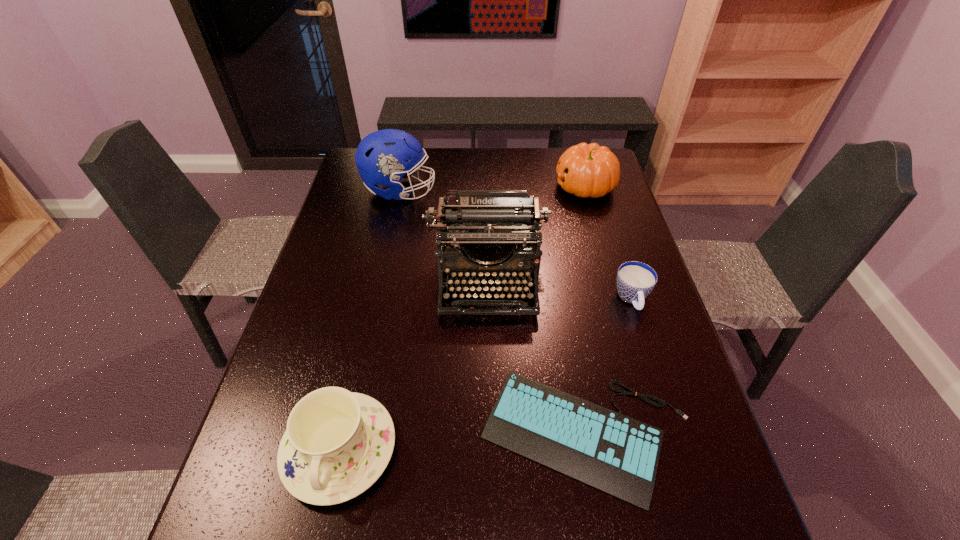
Where is `object that is positioned at the far left corner`? This screenshot has width=960, height=540. object that is positioned at the far left corner is located at coordinates (382, 157).

Find the location of a particular element. This screenshot has height=540, width=960. object located in the far right corner section of the desktop is located at coordinates (586, 170).

Locate an element on the screen. The image size is (960, 540). free space at the far edge of the desktop is located at coordinates (514, 157).

Where is `vacant space at the left edge of the desktop`? This screenshot has height=540, width=960. vacant space at the left edge of the desktop is located at coordinates (325, 357).

Locate an element on the screen. Image resolution: width=960 pixels, height=540 pixels. vacant space at the right edge of the desktop is located at coordinates (619, 207).

This screenshot has width=960, height=540. I want to click on free spot between the computer keyboard and the pumpkin, so click(x=587, y=312).

Where is `free space between the shortest object and the pumpkin`? free space between the shortest object and the pumpkin is located at coordinates (587, 312).

At what (x,y) coordinates should I click in order to perform the action: click on free space between the typewriter and the third shortest object. Please return your answer as a coordinate pair (x, y). The height and width of the screenshot is (540, 960). Looking at the image, I should click on (414, 365).

I want to click on free space that is in between the third shortest object and the football helmet, so click(370, 320).

Find the location of a particular element. The width and height of the screenshot is (960, 540). empty space between the chinaware and the pumpkin is located at coordinates (463, 318).